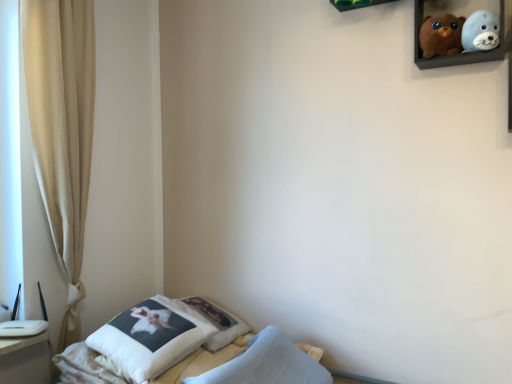
What do you see at coordinates (139, 342) in the screenshot? The image size is (512, 384). I see `white soft pillow at lower left` at bounding box center [139, 342].

Image resolution: width=512 pixels, height=384 pixels. What do you see at coordinates (461, 15) in the screenshot? I see `velvet plush toys at upper right` at bounding box center [461, 15].

I want to click on velvet plush toys at upper right, so click(x=461, y=15).

Identify the location of white soft pillow at lower left, the first pillow from the front. Image resolution: width=512 pixels, height=384 pixels. (151, 337).

Describe the element at coordinates (441, 35) in the screenshot. I see `brown plush bear at upper right, the 1th toy in the left-to-right sequence` at that location.

This screenshot has width=512, height=384. Find the location of `beige fabric curtain at left`. beige fabric curtain at left is located at coordinates (62, 128).

I want to click on white soft pillow at lower left, so click(139, 342).

The width and height of the screenshot is (512, 384). Identify the location of the 2nd pillow to the right of the beige fabric curtain at left, starting your count from the anchor. (x=217, y=322).

In the image, is beige fabric curtain at left positioned in front of or behind white cotton pillow at lower center, which appears as the first pillow when viewed from the back?

beige fabric curtain at left is positioned closer to the viewer than white cotton pillow at lower center, which appears as the first pillow when viewed from the back.

Considering the positions of objects beige fabric curtain at left and white cotton pillow at lower center, marked as the second pillow in a front-to-back arrangement, in the image provided, who is more to the right, beige fabric curtain at left or white cotton pillow at lower center, marked as the second pillow in a front-to-back arrangement,?

Positioned to the right is white cotton pillow at lower center, marked as the second pillow in a front-to-back arrangement.

From the image's perspective, between beige fabric curtain at left and white cotton pillow at lower center, which appears as the first pillow when viewed from the back, which one is located above?

beige fabric curtain at left appears higher in the image.

Where is `window screen located underneath the soft plush seal at upper right, which is counted as the second toy, starting from the left (from a real-world perspective)`? This screenshot has height=384, width=512. window screen located underneath the soft plush seal at upper right, which is counted as the second toy, starting from the left (from a real-world perspective) is located at coordinates (10, 158).

Considering the sizes of objects soft plush seal at upper right, which is counted as the second toy, starting from the left, and transparent glass window at left in the image provided, who is thinner, soft plush seal at upper right, which is counted as the second toy, starting from the left, or transparent glass window at left?

Thinner between the two is soft plush seal at upper right, which is counted as the second toy, starting from the left.

How different are the orientations of soft plush seal at upper right, which is the 1th toy from right to left, and transparent glass window at left in degrees?

87.8 degrees separate the facing orientations of soft plush seal at upper right, which is the 1th toy from right to left, and transparent glass window at left.

Considering the sizes of objects soft plush seal at upper right, which is the 1th toy from right to left, and transparent glass window at left in the image provided, who is taller, soft plush seal at upper right, which is the 1th toy from right to left, or transparent glass window at left?

transparent glass window at left is taller.

Which is behind, point (119, 364) or point (1, 247)?

The point (1, 247) is more distant.

Is white soft pillow at lower left, the first pillow from the front, oriented towards transparent glass window at left?

No.

Is transparent glass window at left located within white soft pillow at lower left, the first pillow from the front?

No, transparent glass window at left is not a part of white soft pillow at lower left, the first pillow from the front.

What's the angular difference between white soft pillow at lower left, the 2th pillow from the back, and transparent glass window at left's facing directions?

7.47 degrees.

Would you say soft plush seal at upper right, which is the 1th toy from right to left, is to the left or to the right of beige fabric curtain at left in the picture?

soft plush seal at upper right, which is the 1th toy from right to left, is positioned on beige fabric curtain at left's right side.

Is the surface of soft plush seal at upper right, which is the 1th toy from right to left, in direct contact with beige fabric curtain at left?

soft plush seal at upper right, which is the 1th toy from right to left, is not next to beige fabric curtain at left, and they're not touching.

Is soft plush seal at upper right, which is counted as the second toy, starting from the left, spatially inside beige fabric curtain at left, or outside of it?

soft plush seal at upper right, which is counted as the second toy, starting from the left, lies outside beige fabric curtain at left.

Is soft plush seal at upper right, which is the 1th toy from right to left, wider than beige fabric curtain at left?

No.

Can you tell me how much white soft pillow at lower left, the first pillow from the front, and brown plush bear at upper right, the 1th toy in the left-to-right sequence, differ in facing direction?

There is a 80.3-degree angle between the facing directions of white soft pillow at lower left, the first pillow from the front, and brown plush bear at upper right, the 1th toy in the left-to-right sequence.

Is white soft pillow at lower left, the 2th pillow from the back, at the right side of brown plush bear at upper right, marked as the second toy in a right-to-left arrangement?

No.

Between white soft pillow at lower left, the first pillow from the front, and brown plush bear at upper right, the 1th toy in the left-to-right sequence, which one has smaller width?

brown plush bear at upper right, the 1th toy in the left-to-right sequence.

Would you say brown plush bear at upper right, marked as the second toy in a right-to-left arrangement, is part of white soft pillow at lower left, the first pillow from the front,'s contents?

No, brown plush bear at upper right, marked as the second toy in a right-to-left arrangement, is not surrounded by white soft pillow at lower left, the first pillow from the front.

Does soft plush seal at upper right, which is counted as the second toy, starting from the left, have a smaller size compared to velvet plush toys at upper right?

Yes.

From a real-world perspective, is soft plush seal at upper right, which is counted as the second toy, starting from the left, located higher than velvet plush toys at upper right?

No.

Does soft plush seal at upper right, which is counted as the second toy, starting from the left, turn towards velvet plush toys at upper right?

Yes, soft plush seal at upper right, which is counted as the second toy, starting from the left, is turned towards velvet plush toys at upper right.

Which object is positioned more to the right, soft plush seal at upper right, which is the 1th toy from right to left, or velvet plush toys at upper right?

soft plush seal at upper right, which is the 1th toy from right to left, is more to the right.

Which is behind, wooden shelf at upper center or white cotton pillow at lower center, which appears as the first pillow when viewed from the back?

white cotton pillow at lower center, which appears as the first pillow when viewed from the back, is further from the camera.

Is there a large distance between wooden shelf at upper center and white cotton pillow at lower center, marked as the second pillow in a front-to-back arrangement?

That's right, there is a large distance between wooden shelf at upper center and white cotton pillow at lower center, marked as the second pillow in a front-to-back arrangement.

Does wooden shelf at upper center have a larger size compared to white cotton pillow at lower center, marked as the second pillow in a front-to-back arrangement?

No, wooden shelf at upper center is not bigger than white cotton pillow at lower center, marked as the second pillow in a front-to-back arrangement.

Locate an element on the screen. The image size is (512, 384). curtain that is above the white cotton pillow at lower center, marked as the second pillow in a front-to-back arrangement (from the image's perspective) is located at coordinates (62, 128).

Image resolution: width=512 pixels, height=384 pixels. What are the coordinates of `window screen lying behind the soft plush seal at upper right, which is counted as the second toy, starting from the left` in the screenshot? It's located at (10, 158).

Looking at the image, which one is located further to transparent glass window at left, white soft pillow at lower left or soft plush seal at upper right, which is counted as the second toy, starting from the left?

soft plush seal at upper right, which is counted as the second toy, starting from the left, lies further to transparent glass window at left than the other object.

Considering their positions, is white soft pillow at lower left, the 2th pillow from the back, positioned further to white cotton pillow at lower center, which appears as the first pillow when viewed from the back, than velvet plush toys at upper right?

Based on the image, velvet plush toys at upper right appears to be further to white cotton pillow at lower center, which appears as the first pillow when viewed from the back.

From the image, which object appears to be farther from white soft pillow at lower left, the 2th pillow from the back, white cotton pillow at lower center, which appears as the first pillow when viewed from the back, or brown plush bear at upper right, marked as the second toy in a right-to-left arrangement?

brown plush bear at upper right, marked as the second toy in a right-to-left arrangement.

Which object lies further to the anchor point beige fabric curtain at left, wooden shelf at upper center or soft plush seal at upper right, which is counted as the second toy, starting from the left?

Among the two, soft plush seal at upper right, which is counted as the second toy, starting from the left, is located further to beige fabric curtain at left.

Which object lies further to the anchor point soft plush seal at upper right, which is counted as the second toy, starting from the left, brown plush bear at upper right, marked as the second toy in a right-to-left arrangement, or white soft pillow at lower left, the 2th pillow from the back?

Among the two, white soft pillow at lower left, the 2th pillow from the back, is located further to soft plush seal at upper right, which is counted as the second toy, starting from the left.

From the image, which object appears to be farther from soft plush seal at upper right, which is the 1th toy from right to left, white soft pillow at lower left or white soft pillow at lower left, the 2th pillow from the back?

white soft pillow at lower left, the 2th pillow from the back, is further to soft plush seal at upper right, which is the 1th toy from right to left.

Looking at this image, when comparing their distances from transparent glass window at left, does soft plush seal at upper right, which is the 1th toy from right to left, or white soft pillow at lower left seem further?

soft plush seal at upper right, which is the 1th toy from right to left, lies further to transparent glass window at left than the other object.

When comparing their distances from white soft pillow at lower left, the 2th pillow from the back, does brown plush bear at upper right, marked as the second toy in a right-to-left arrangement, or soft plush seal at upper right, which is counted as the second toy, starting from the left, seem closer?

brown plush bear at upper right, marked as the second toy in a right-to-left arrangement, lies closer to white soft pillow at lower left, the 2th pillow from the back, than the other object.

Find the location of a particular element. The height and width of the screenshot is (384, 512). shelf between beige fabric curtain at left and soft plush seal at upper right, which is the 1th toy from right to left, in the horizontal direction is located at coordinates (356, 4).

Identify the location of curtain between transparent glass window at left and white soft pillow at lower left, the first pillow from the front, in the vertical direction. The height and width of the screenshot is (384, 512). (62, 128).

You are a GUI agent. You are given a task and a screenshot of the screen. Output one action in this format:
    pyautogui.click(x=<x>, y=<y>)
    Task: Click on the shelf located between beige fabric curtain at left and velvet plush toys at upper right in the left-right direction
    This screenshot has height=384, width=512.
    Given the screenshot: What is the action you would take?
    pyautogui.click(x=356, y=4)

Locate an element on the screen. The height and width of the screenshot is (384, 512). bed between transparent glass window at left and soft plush seal at upper right, which is the 1th toy from right to left, in the horizontal direction is located at coordinates (139, 342).